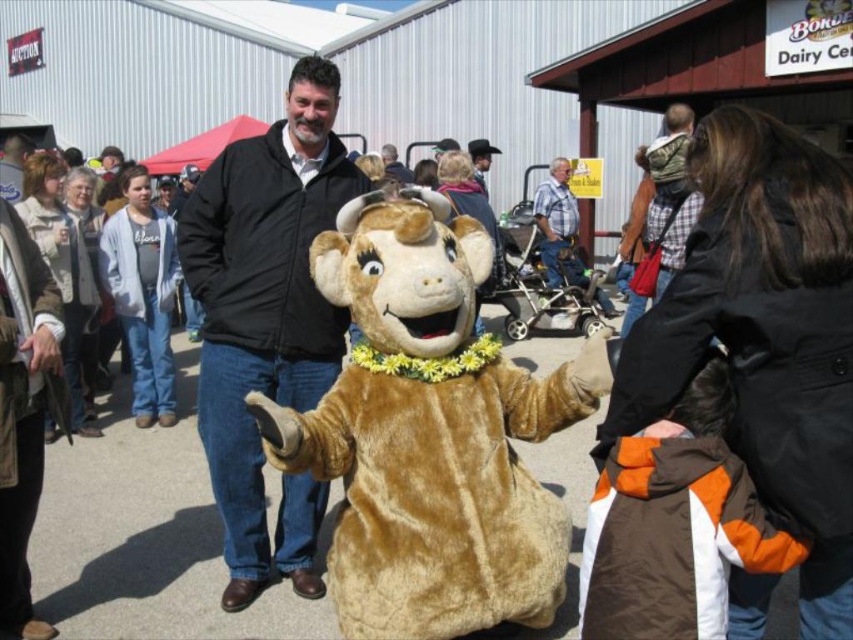
Question: Does fuzzy brown bear at center have a smaller size compared to blue plaid shirt at center?

Choices:
 (A) yes
 (B) no

Answer: (A)

Question: Considering the real-world distances, which object is closest to the blue plaid shirt at center?

Choices:
 (A) black softshell jacket at center
 (B) fuzzy brown bear at center

Answer: (A)

Question: Which point appears farthest from the camera in this image?

Choices:
 (A) (390, 163)
 (B) (560, 538)
 (C) (552, 268)

Answer: (A)

Question: Considering the real-world distances, which object is farthest from the blue plaid shirt at center?

Choices:
 (A) dark brown leather jacket at center
 (B) black softshell jacket at center

Answer: (B)

Question: Can you confirm if black softshell jacket at center is positioned to the right of dark brown leather jacket at center?

Choices:
 (A) no
 (B) yes

Answer: (A)

Question: Can you confirm if fuzzy brown bear at center is thinner than blue plaid shirt at center?

Choices:
 (A) yes
 (B) no

Answer: (B)